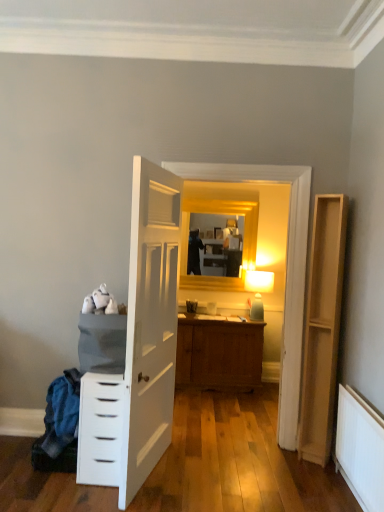
Question: Is gold wooden mirror at upper center with light brown wood file cabinet at right?

Choices:
 (A) no
 (B) yes

Answer: (A)

Question: Is gold wooden mirror at upper center smaller than light brown wood file cabinet at right?

Choices:
 (A) no
 (B) yes

Answer: (B)

Question: Is gold wooden mirror at upper center facing towards light brown wood file cabinet at right?

Choices:
 (A) yes
 (B) no

Answer: (A)

Question: From a real-world perspective, is gold wooden mirror at upper center on light brown wood file cabinet at right?

Choices:
 (A) yes
 (B) no

Answer: (A)

Question: Is gold wooden mirror at upper center outside of light brown wood file cabinet at right?

Choices:
 (A) yes
 (B) no

Answer: (A)

Question: Considering the positions of light brown wood file cabinet at right and white fabric laundry at lower left in the image, is light brown wood file cabinet at right taller or shorter than white fabric laundry at lower left?

Choices:
 (A) short
 (B) tall

Answer: (B)

Question: From a real-world perspective, is light brown wood file cabinet at right above or below white fabric laundry at lower left?

Choices:
 (A) above
 (B) below

Answer: (A)

Question: Is point (324, 258) closer or farther from the camera than point (56, 467)?

Choices:
 (A) closer
 (B) farther

Answer: (B)

Question: Is light brown wood file cabinet at right in front of or behind white fabric laundry at lower left in the image?

Choices:
 (A) behind
 (B) front

Answer: (A)

Question: Is white painted radiator at lower right bigger or smaller than white fabric laundry at lower left?

Choices:
 (A) big
 (B) small

Answer: (B)

Question: Looking at their shapes, would you say white painted radiator at lower right is wider or thinner than white fabric laundry at lower left?

Choices:
 (A) wide
 (B) thin

Answer: (B)

Question: Is point (354, 443) positioned closer to the camera than point (66, 415)?

Choices:
 (A) farther
 (B) closer

Answer: (B)

Question: In the image, is white painted radiator at lower right on the left side or the right side of white fabric laundry at lower left?

Choices:
 (A) left
 (B) right

Answer: (B)

Question: From a real-world perspective, relative to white glossy chest of drawers at left, is gold wooden mirror at upper center vertically above or below?

Choices:
 (A) above
 (B) below

Answer: (A)

Question: Considering the relative positions of gold wooden mirror at upper center and white glossy chest of drawers at left in the image provided, is gold wooden mirror at upper center to the left or to the right of white glossy chest of drawers at left?

Choices:
 (A) right
 (B) left

Answer: (A)